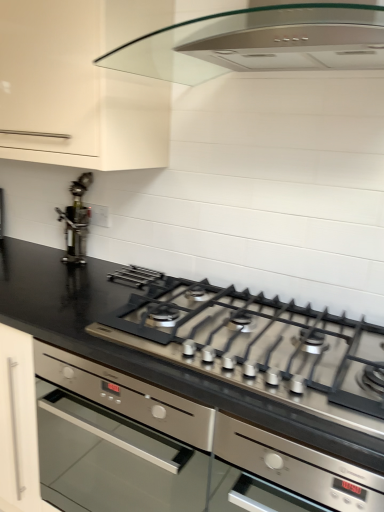
What do you see at coordinates (76, 221) in the screenshot? I see `stainless steel at left` at bounding box center [76, 221].

The image size is (384, 512). Describe the element at coordinates (82, 84) in the screenshot. I see `matte white cabinet at upper left` at that location.

This screenshot has height=512, width=384. Find the location of `matte white cabinet at upper left`. matte white cabinet at upper left is located at coordinates (82, 84).

Find the location of a particular element. This screenshot has height=512, width=384. satin silver gas stove at center is located at coordinates (261, 347).

Could you tell me if stainless steel at left is facing satin silver gas stove at center?

No, stainless steel at left is not aimed at satin silver gas stove at center.

Which of these two, stainless steel at left or satin silver gas stove at center, stands shorter?

satin silver gas stove at center is shorter.

Is stainless steel at left to the left or to the right of satin silver gas stove at center in the image?

Based on their positions, stainless steel at left is located to the left of satin silver gas stove at center.

Identify the location of stainless steel above the satin silver gas stove at center (from a real-world perspective). (76, 221).

Does stainless steel at left have a lesser height compared to black glossy countertop at center?

Correct, stainless steel at left is not as tall as black glossy countertop at center.

In terms of width, does stainless steel at left look wider or thinner when compared to black glossy countertop at center?

stainless steel at left is thinner than black glossy countertop at center.

Is stainless steel at left to the left or to the right of black glossy countertop at center in the image?

stainless steel at left is to the left of black glossy countertop at center.

Does satin silver gas stove at center touch black glossy countertop at center?

No.

Considering the relative positions of satin silver gas stove at center and black glossy countertop at center in the image provided, is satin silver gas stove at center to the left or to the right of black glossy countertop at center?

satin silver gas stove at center is positioned on black glossy countertop at center's right side.

From the image's perspective, which is below, satin silver gas stove at center or black glossy countertop at center?

From the image's view, black glossy countertop at center is below.

Which is in front, satin silver gas stove at center or black glossy countertop at center?

satin silver gas stove at center is more forward.

From the image's perspective, is black glossy countertop at center located above stainless steel at left?

No, from the image's perspective, black glossy countertop at center is not on top of stainless steel at left.

Looking at this image, is black glossy countertop at center inside or outside of stainless steel at left?

black glossy countertop at center exists outside the volume of stainless steel at left.

Could you tell me if black glossy countertop at center is facing stainless steel at left?

No, black glossy countertop at center is not facing towards stainless steel at left.

How many degrees apart are the facing directions of black glossy countertop at center and stainless steel at left?

1.73 degrees.

From a real-world perspective, which is physically above, matte white cabinet at upper left or stainless steel at left?

matte white cabinet at upper left is physically above.

Is matte white cabinet at upper left not inside stainless steel at left?

matte white cabinet at upper left lies outside stainless steel at left's area.

Does matte white cabinet at upper left have a greater height compared to stainless steel at left?

Yes, matte white cabinet at upper left is taller than stainless steel at left.

Consider the image. Is the position of satin silver gas stove at center less distant than that of stainless steel at left?

Yes, it is.

Looking at this image, is satin silver gas stove at center facing towards stainless steel at left?

No, satin silver gas stove at center is not oriented towards stainless steel at left.

Considering the sizes of satin silver gas stove at center and stainless steel at left in the image, is satin silver gas stove at center taller or shorter than stainless steel at left?

satin silver gas stove at center is shorter than stainless steel at left.

This screenshot has height=512, width=384. Identify the location of gas stove below the stainless steel at left (from the image's perspective). (261, 347).

Looking at this image, which object is thinner, stainless steel at left or matte white cabinet at upper left?

Thinner between the two is stainless steel at left.

From their relative heights in the image, would you say stainless steel at left is taller or shorter than matte white cabinet at upper left?

In the image, stainless steel at left appears to be shorter than matte white cabinet at upper left.

From the image's perspective, is stainless steel at left under matte white cabinet at upper left?

Yes, from the image's perspective, stainless steel at left is below matte white cabinet at upper left.

Is stainless steel at left far away from matte white cabinet at upper left?

No, stainless steel at left is in close proximity to matte white cabinet at upper left.

In order to click on stainless steel lying behind the satin silver gas stove at center in this screenshot , I will do `click(76, 221)`.

What are the coordinates of `stainless steel positioned vertically above the black glossy countertop at center (from a real-world perspective)` in the screenshot? It's located at (76, 221).

Considering their positions, is matte white cabinet at upper left positioned closer to stainless steel at left than black glossy countertop at center?

matte white cabinet at upper left is positioned closer to the anchor stainless steel at left.

Estimate the real-world distances between objects in this image. Which object is closer to satin silver gas stove at center, stainless steel at left or matte white cabinet at upper left?

matte white cabinet at upper left is closer to satin silver gas stove at center.

From the image, which object appears to be nearer to black glossy countertop at center, stainless steel at left or matte white cabinet at upper left?

Based on the image, stainless steel at left appears to be nearer to black glossy countertop at center.

Looking at this image, based on their spatial positions, is black glossy countertop at center or matte white cabinet at upper left further from stainless steel at left?

Based on the image, black glossy countertop at center appears to be further to stainless steel at left.

Which object lies nearer to the anchor point satin silver gas stove at center, black glossy countertop at center or matte white cabinet at upper left?

black glossy countertop at center lies closer to satin silver gas stove at center than the other object.

Looking at the image, which one is located further to satin silver gas stove at center, matte white cabinet at upper left or stainless steel at left?

The object further to satin silver gas stove at center is stainless steel at left.

From the image, which object appears to be nearer to matte white cabinet at upper left, stainless steel at left or black glossy countertop at center?

Based on the image, stainless steel at left appears to be nearer to matte white cabinet at upper left.

Which object lies further to the anchor point black glossy countertop at center, matte white cabinet at upper left or stainless steel at left?

Among the two, matte white cabinet at upper left is located further to black glossy countertop at center.

This screenshot has width=384, height=512. I want to click on countertop positioned between satin silver gas stove at center and stainless steel at left from near to far, so click(x=209, y=375).

I want to click on stainless steel that lies between matte white cabinet at upper left and black glossy countertop at center from top to bottom, so click(76, 221).

Find the location of a particular element. Image resolution: width=384 pixels, height=512 pixels. gas stove between matte white cabinet at upper left and black glossy countertop at center from top to bottom is located at coordinates click(x=261, y=347).

At what (x,y) coordinates should I click in order to perform the action: click on stainless steel between matte white cabinet at upper left and satin silver gas stove at center in the vertical direction. Please return your answer as a coordinate pair (x, y). The width and height of the screenshot is (384, 512). Looking at the image, I should click on (76, 221).